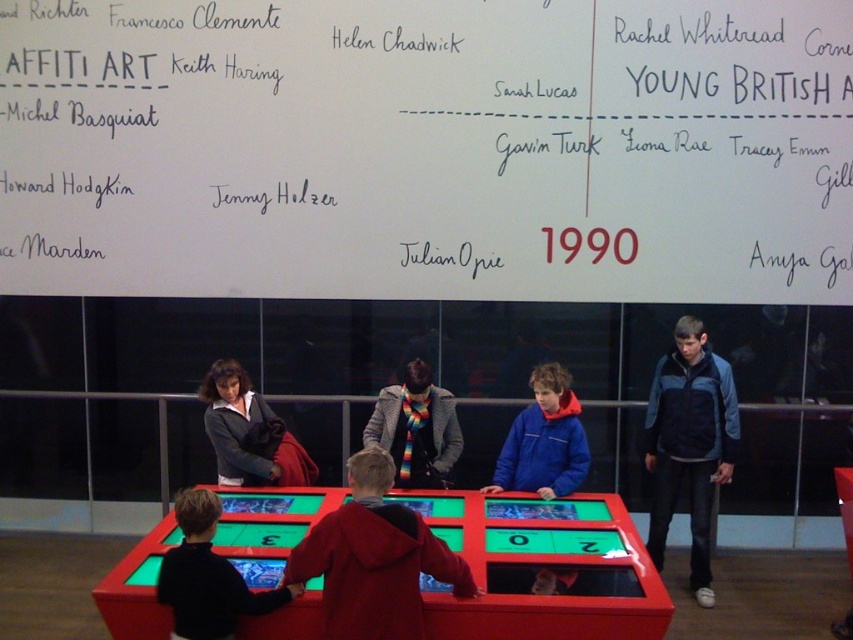
You are a security guard in the museum. You need to ensure that visitors maintain a minimum distance of 40 centimeters between them for safety. Are the red hoodie at center and the black sweater at lower left violating this rule?

The red hoodie at center and the black sweater at lower left are 38.82 centimeters apart from each other, which is less than the required 40 centimeters. Therefore, they are violating the safety distance rule.

You are a museum visitor who wants to take a photo of the exhibit without blocking anyone. You notice the blue fleece jacket at right and the black sweater at lower left. Which person should you avoid standing in front of to take your photo?

You should avoid standing in front of the black sweater at lower left because the blue fleece jacket at right is to the right of it, so positioning yourself to avoid the left area would prevent blocking both individuals.